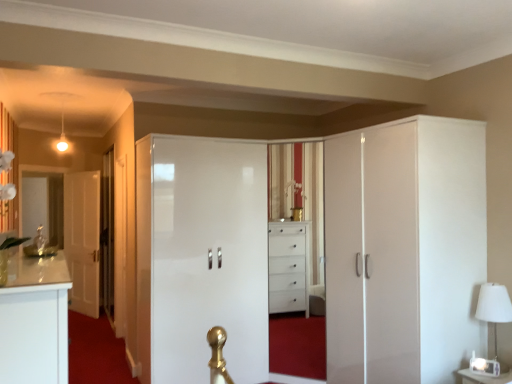
Question: Should I look upward or downward to see white glossy cupboard at right?

Choices:
 (A) up
 (B) down

Answer: (B)

Question: Is white fabric lampshade at right bigger than white glossy door at left, which appears as the 1th door when viewed from the back?

Choices:
 (A) yes
 (B) no

Answer: (B)

Question: Is white fabric lampshade at right located outside white glossy door at left, which appears as the 1th door when viewed from the back?

Choices:
 (A) yes
 (B) no

Answer: (A)

Question: Is the position of white fabric lampshade at right more distant than that of white glossy door at left, which is the 1th door from left to right?

Choices:
 (A) yes
 (B) no

Answer: (B)

Question: From the image's perspective, is white fabric lampshade at right under white glossy door at left, which appears as the 1th door when viewed from the back?

Choices:
 (A) yes
 (B) no

Answer: (A)

Question: Is white fabric lampshade at right at the right side of white glossy door at left, which appears as the 1th door when viewed from the back?

Choices:
 (A) yes
 (B) no

Answer: (A)

Question: Does white fabric lampshade at right have a greater width compared to white glossy door at left, which appears as the 1th door when viewed from the back?

Choices:
 (A) no
 (B) yes

Answer: (B)

Question: Can you confirm if transparent glass door at left is taller than white glossy dresser at center?

Choices:
 (A) yes
 (B) no

Answer: (A)

Question: From the image's perspective, is transparent glass door at left beneath white glossy dresser at center?

Choices:
 (A) yes
 (B) no

Answer: (B)

Question: Is transparent glass door at left further to the viewer compared to white glossy dresser at center?

Choices:
 (A) no
 (B) yes

Answer: (B)

Question: Is transparent glass door at left not near white glossy dresser at center?

Choices:
 (A) no
 (B) yes

Answer: (B)

Question: Is transparent glass door at left not within white glossy dresser at center?

Choices:
 (A) no
 (B) yes

Answer: (B)

Question: From the image's perspective, would you say transparent glass door at left is positioned over white glossy dresser at center?

Choices:
 (A) yes
 (B) no

Answer: (A)

Question: From a real-world perspective, is glossy white wardrobe at center, acting as the 1th door starting from the right, beneath transparent glass door at left?

Choices:
 (A) yes
 (B) no

Answer: (A)